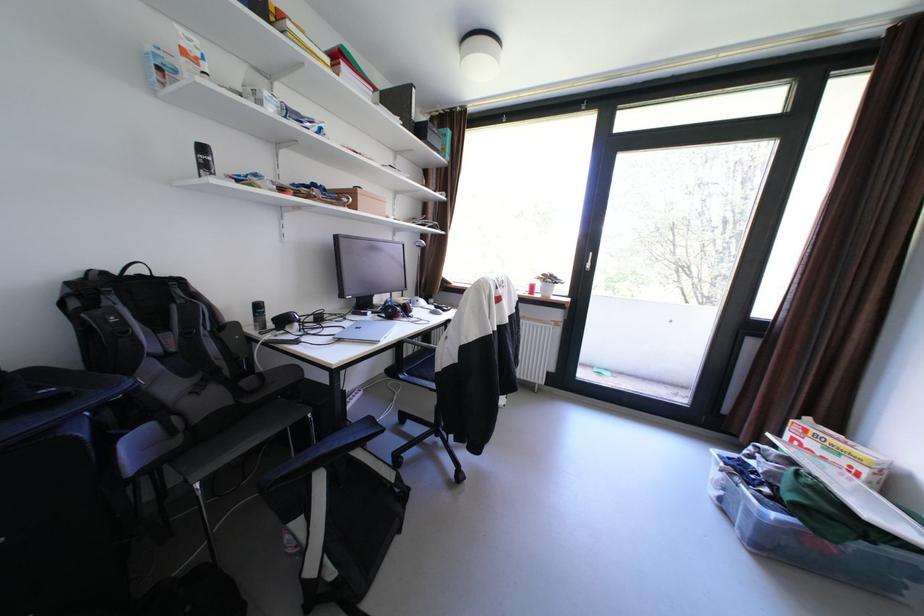
Locate an element on the screen. This screenshot has height=616, width=924. black spray can is located at coordinates (259, 315).